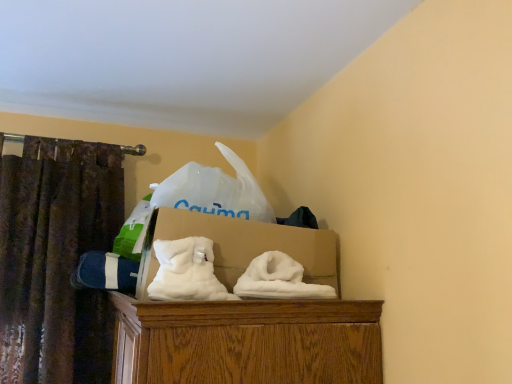
The width and height of the screenshot is (512, 384). What do you see at coordinates (56, 260) in the screenshot?
I see `brown textured curtain at left` at bounding box center [56, 260].

The height and width of the screenshot is (384, 512). I want to click on brown textured curtain at left, so click(56, 260).

What is the approximate width of white cardboard box at center?

white cardboard box at center is 19.82 inches in width.

What do you see at coordinates (241, 246) in the screenshot? This screenshot has height=384, width=512. I see `white cardboard box at center` at bounding box center [241, 246].

You are a GUI agent. You are given a task and a screenshot of the screen. Output one action in this format:
    pyautogui.click(x=<x>, y=<y>)
    Task: Click on the white cardboard box at center
    This screenshot has width=512, height=384.
    Given the screenshot: What is the action you would take?
    pyautogui.click(x=241, y=246)

You are a GUI agent. You are given a task and a screenshot of the screen. Output one action in this format:
    pyautogui.click(x=<x>, y=<y>)
    Task: Click on the brown textured curtain at left
    
    Given the screenshot: What is the action you would take?
    pyautogui.click(x=56, y=260)

Which is more to the right, brown textured curtain at left or white cardboard box at center?

white cardboard box at center.

Which is in front, brown textured curtain at left or white cardboard box at center?

white cardboard box at center is in front.

Is point (72, 296) less distant than point (320, 255)?

No, it is behind (320, 255).

From the image's perspective, is brown textured curtain at left on top of white cardboard box at center?

Incorrect, from the image's perspective, brown textured curtain at left is lower than white cardboard box at center.

From a real-world perspective, is brown textured curtain at left physically located above or below white cardboard box at center?

From a real-world perspective, brown textured curtain at left is physically below white cardboard box at center.

Is brown textured curtain at left wider than white cardboard box at center?

In fact, brown textured curtain at left might be narrower than white cardboard box at center.

Can you confirm if brown textured curtain at left is shorter than white cardboard box at center?

No.

Does brown textured curtain at left have a smaller size compared to white cardboard box at center?

No.

Choose the correct answer: Is brown textured curtain at left inside white cardboard box at center or outside it?

brown textured curtain at left lies outside white cardboard box at center.

Is brown textured curtain at left with white cardboard box at center?

brown textured curtain at left is not next to white cardboard box at center, and they're not touching.

Is brown textured curtain at left aimed at white cardboard box at center?

No, brown textured curtain at left is not aimed at white cardboard box at center.

The image size is (512, 384). There is a brown textured curtain at left. In order to click on box above it (from a real-world perspective) in this screenshot , I will do `click(241, 246)`.

Would you say white cardboard box at center is to the left or to the right of brown textured curtain at left in the picture?

white cardboard box at center is to the right of brown textured curtain at left.

In the image, is white cardboard box at center positioned in front of or behind brown textured curtain at left?

Clearly, white cardboard box at center is in front of brown textured curtain at left.

Does point (231, 292) come closer to viewer compared to point (52, 327)?

Yes, point (231, 292) is in front of point (52, 327).

From the image's perspective, between white cardboard box at center and brown textured curtain at left, who is located below?

brown textured curtain at left, from the image's perspective.

From the picture: From a real-world perspective, which object rests below the other?

brown textured curtain at left.

Can you confirm if white cardboard box at center is thinner than brown textured curtain at left?

Incorrect, the width of white cardboard box at center is not less than that of brown textured curtain at left.

Can you confirm if white cardboard box at center is shorter than brown textured curtain at left?

Correct, white cardboard box at center is not as tall as brown textured curtain at left.

Looking at this image, in terms of size, does white cardboard box at center appear bigger or smaller than brown textured curtain at left?

Clearly, white cardboard box at center is smaller in size than brown textured curtain at left.

Would you say brown textured curtain at left is part of white cardboard box at center's contents?

No, brown textured curtain at left is not surrounded by white cardboard box at center.

Is white cardboard box at center far away from brown textured curtain at left?

That's not correct — white cardboard box at center is a little close to brown textured curtain at left.

Could you tell me if white cardboard box at center is facing brown textured curtain at left?

No, white cardboard box at center is not turned towards brown textured curtain at left.

How much distance is there between white cardboard box at center and brown textured curtain at left?

white cardboard box at center is 26.27 inches from brown textured curtain at left.

Image resolution: width=512 pixels, height=384 pixels. I want to click on curtain that is behind the white cardboard box at center, so pos(56,260).

Image resolution: width=512 pixels, height=384 pixels. Find the location of `box on the right of brown textured curtain at left`. box on the right of brown textured curtain at left is located at coordinates (241, 246).

You are a GUI agent. You are given a task and a screenshot of the screen. Output one action in this format:
    pyautogui.click(x=<x>, y=<y>)
    Task: Click on the curtain located behind the white cardboard box at center
    Image resolution: width=512 pixels, height=384 pixels.
    Given the screenshot: What is the action you would take?
    pyautogui.click(x=56, y=260)